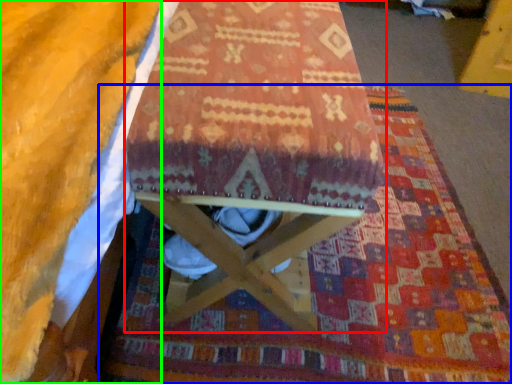
Question: Which object is the farthest from furniture (highlighted by a red box)? Choose among these: mat (highlighted by a blue box) or blanket (highlighted by a green box).

Choices:
 (A) mat
 (B) blanket

Answer: (A)